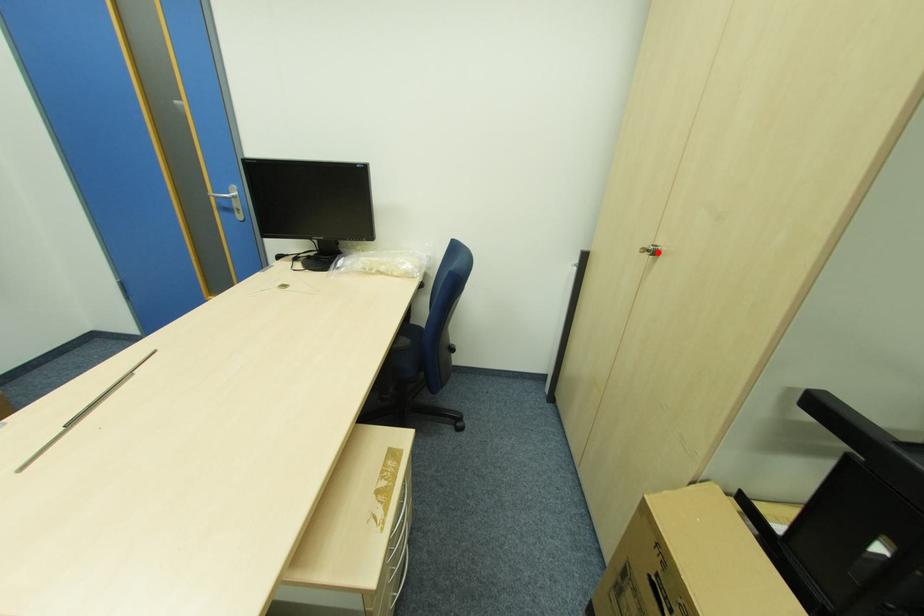
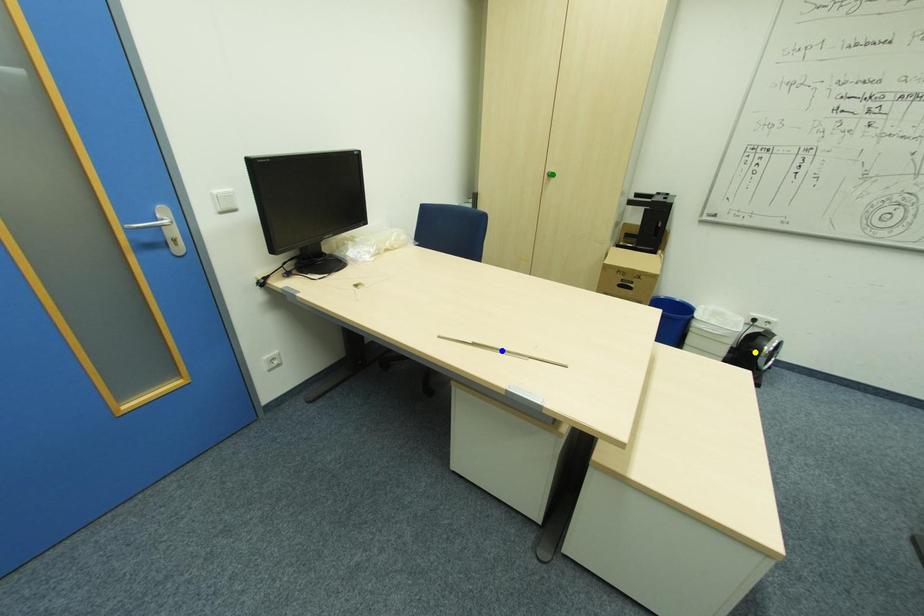
Question: I am providing you with two images of the same scene from different viewpoints. A red point is marked on the first image. You are given multiple points on the second image. Which point in image 2 is actually the same real-world point as the red point in image 1?

Choices:
 (A) green point
 (B) yellow point
 (C) blue point

Answer: (A)